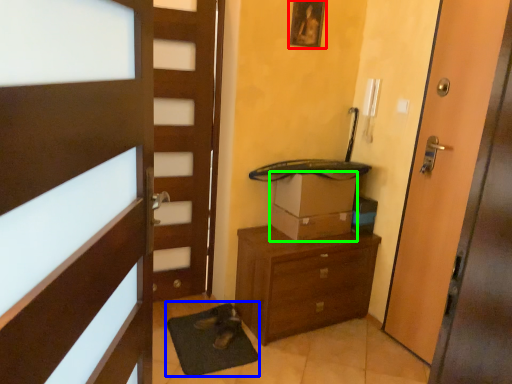
Question: Based on their relative distances, which object is nearer to picture frame (highlighted by a red box)? Choose from bath mat (highlighted by a blue box) and cardboard box (highlighted by a green box).

Choices:
 (A) bath mat
 (B) cardboard box

Answer: (B)